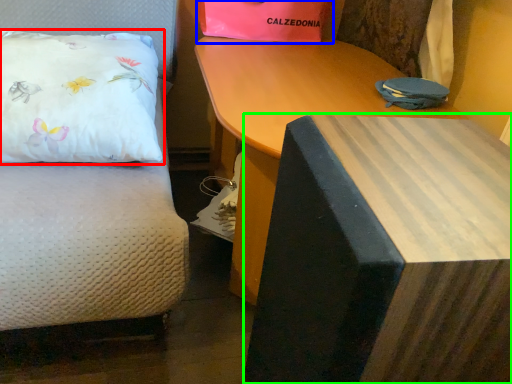
Question: Based on their relative distances, which object is nearer to pillow (highlighted by a red box)? Choose from gift bag (highlighted by a blue box) and table (highlighted by a green box).

Choices:
 (A) gift bag
 (B) table

Answer: (A)